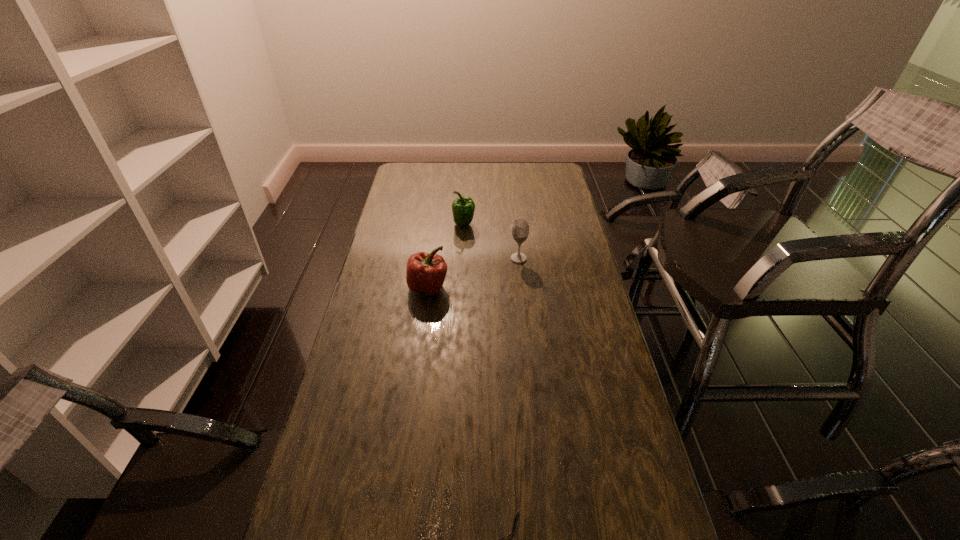
The width and height of the screenshot is (960, 540). Identify the location of free space that satisfies the following two spatial constraints: 1. on the back side of the farther bell pepper; 2. on the left side of the nearer bell pepper. (437, 224).